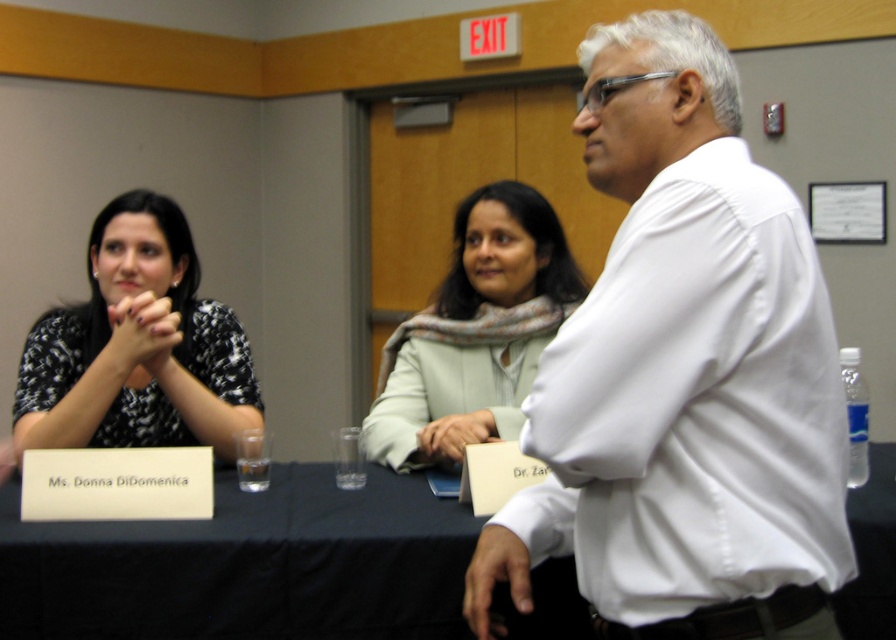
Does light green fabric scarf at center have a greater width compared to smooth beige hand at center?

Yes.

Between light green fabric scarf at center and smooth beige hand at center, which one has less height?

With less height is smooth beige hand at center.

Who is more distant from viewer, (x=457, y=417) or (x=474, y=435)?

The point (x=457, y=417) is more distant.

Identify the location of light green fabric scarf at center. This screenshot has width=896, height=640. (475, 333).

Does white shirt at upper right have a lesser height compared to black dotted dress at left?

Incorrect, white shirt at upper right's height does not fall short of black dotted dress at left's.

Does white shirt at upper right have a lesser width compared to black dotted dress at left?

Yes.

Identify the location of white shirt at upper right. This screenshot has width=896, height=640. (683, 376).

How much distance is there between white shirt at upper right and smooth beige hand at center?

white shirt at upper right and smooth beige hand at center are 28.86 inches apart.

Is the position of white shirt at upper right more distant than that of smooth beige hand at center?

No, white shirt at upper right is in front of smooth beige hand at center.

The width and height of the screenshot is (896, 640). Describe the element at coordinates (683, 376) in the screenshot. I see `white shirt at upper right` at that location.

The height and width of the screenshot is (640, 896). I want to click on white shirt at upper right, so click(x=683, y=376).